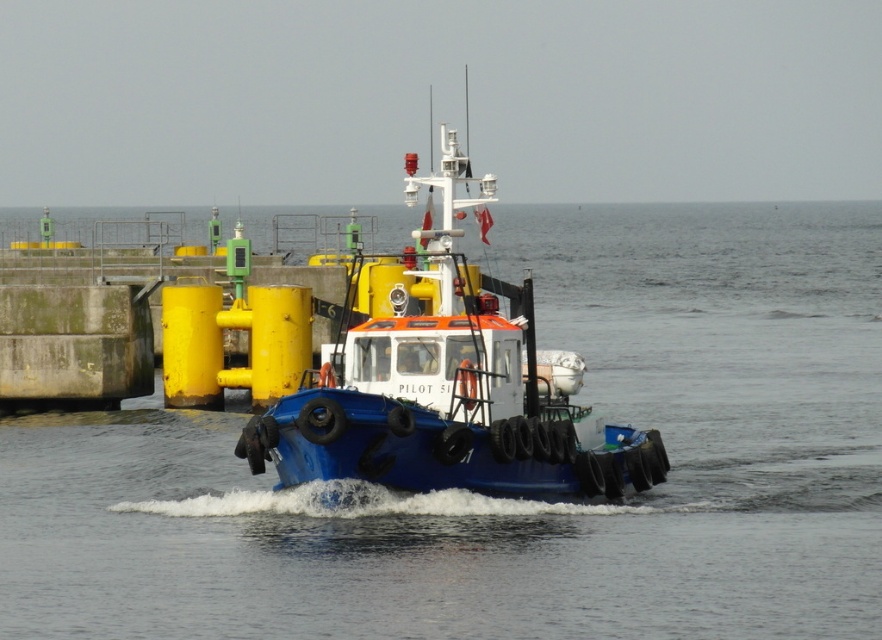
Question: Does blue water at center have a smaller size compared to blue rubber boat at center?

Choices:
 (A) yes
 (B) no

Answer: (B)

Question: Does blue water at center have a smaller size compared to blue rubber boat at center?

Choices:
 (A) no
 (B) yes

Answer: (A)

Question: Is blue water at center to the right of blue rubber boat at center from the viewer's perspective?

Choices:
 (A) yes
 (B) no

Answer: (B)